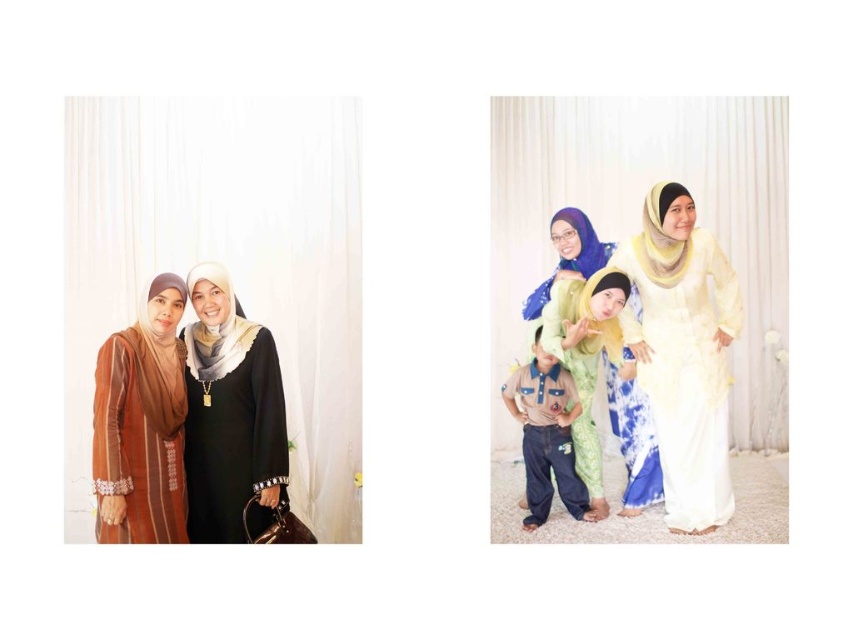
Is point (573, 381) farther from viewer compared to point (660, 246)?

Yes, point (573, 381) is farther from viewer.

Does denim pants at center have a greater height compared to yellow satin shawl at upper right?

Indeed, denim pants at center has a greater height compared to yellow satin shawl at upper right.

Does point (537, 451) come in front of point (654, 188)?

That is False.

I want to click on denim pants at center, so click(546, 435).

Can you confirm if denim pants at center is thinner than blue satin shawl at center?

Indeed, denim pants at center has a lesser width compared to blue satin shawl at center.

Is denim pants at center shorter than blue satin shawl at center?

In fact, denim pants at center may be taller than blue satin shawl at center.

Which is in front, point (570, 420) or point (543, 294)?

Positioned in front is point (570, 420).

This screenshot has width=853, height=640. Identify the location of denim pants at center. (546, 435).

Does matte brown dress at left appear on the right side of yellow satin shawl at upper right?

Incorrect, matte brown dress at left is not on the right side of yellow satin shawl at upper right.

Does point (132, 326) come in front of point (643, 211)?

That is True.

Is point (113, 451) positioned after point (637, 253)?

No, it is not.

Where is `matte brown dress at left`? This screenshot has width=853, height=640. matte brown dress at left is located at coordinates (141, 424).